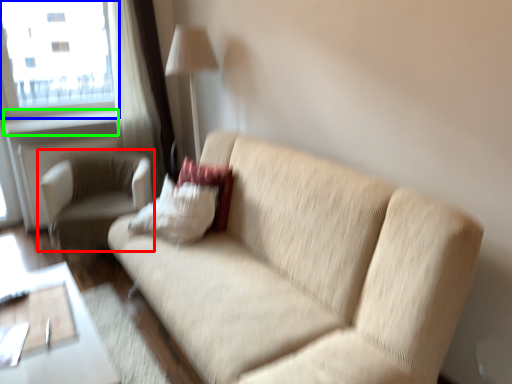
Question: Estimate the real-world distances between objects in this image. Which object is farther from chair (highlighted by a red box), window (highlighted by a blue box) or window sill (highlighted by a green box)?

Choices:
 (A) window
 (B) window sill

Answer: (A)